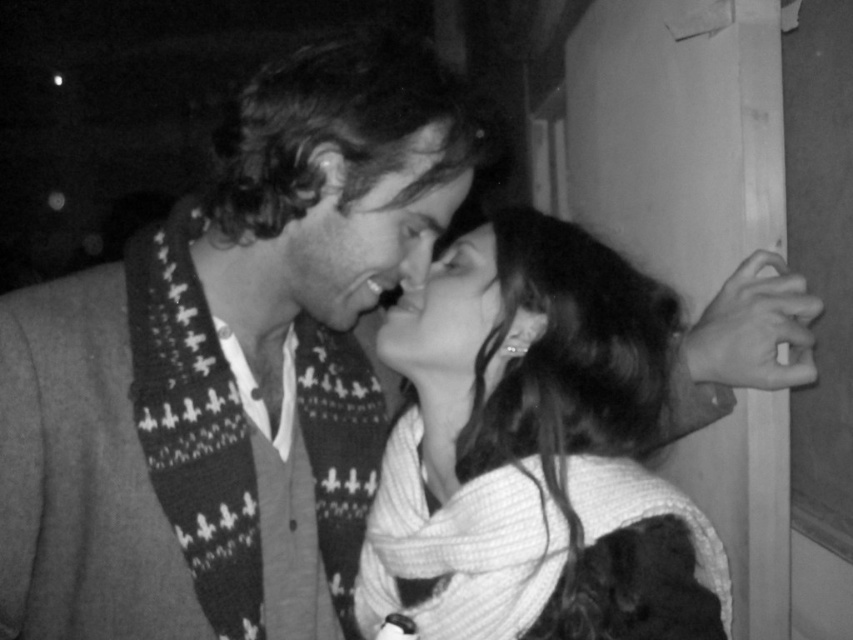
Question: Is knitted scarf at center above smooth skin face at center?

Choices:
 (A) no
 (B) yes

Answer: (B)

Question: Can you confirm if white textured scarf at center is positioned to the right of knitted scarf at center?

Choices:
 (A) no
 (B) yes

Answer: (B)

Question: Which point is closer to the camera?

Choices:
 (A) (396, 262)
 (B) (457, 282)
 (C) (560, 570)

Answer: (C)

Question: Can you confirm if white textured scarf at center is smaller than knitted scarf at center?

Choices:
 (A) no
 (B) yes

Answer: (A)

Question: Among these objects, which one is farthest from the camera?

Choices:
 (A) white textured scarf at center
 (B) knitted scarf at center

Answer: (B)

Question: Which point is closer to the camera?

Choices:
 (A) (468, 326)
 (B) (331, 208)

Answer: (B)